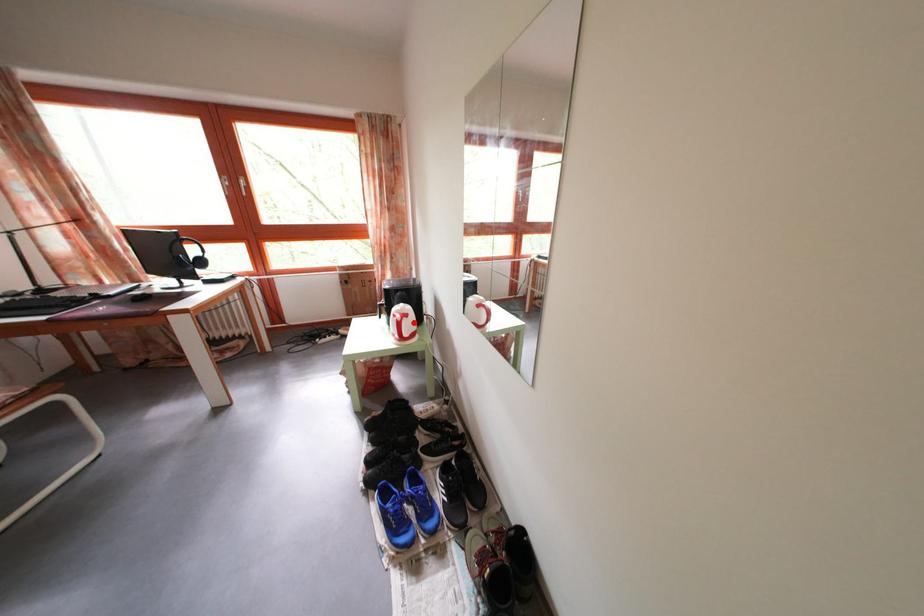
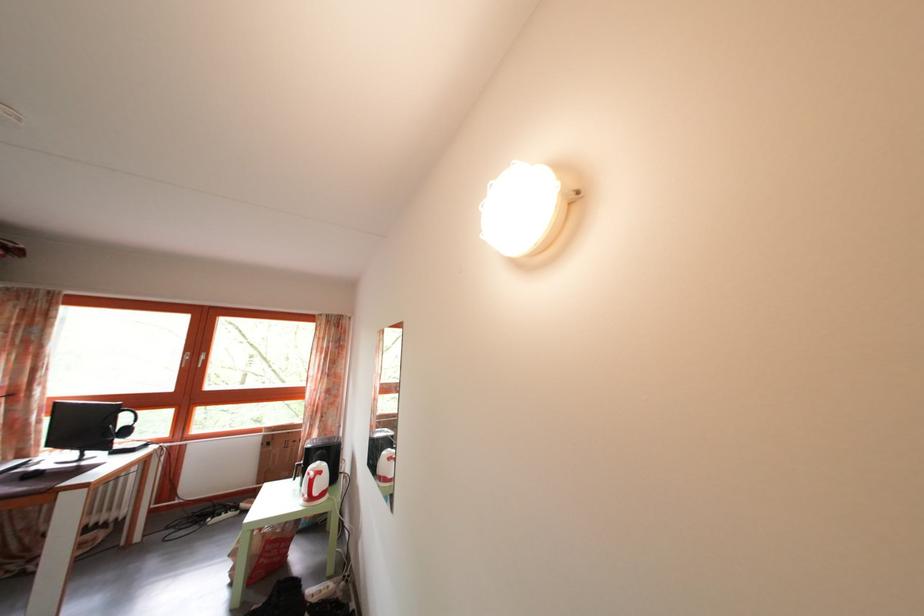
Question: I am providing you with two images of the same scene from different viewpoints. Image1 has a red point marked. In image2, the corresponding 3D location appears at what relative position? Reply with the corresponding letter.

Choices:
 (A) Closer
 (B) Farther

Answer: (B)